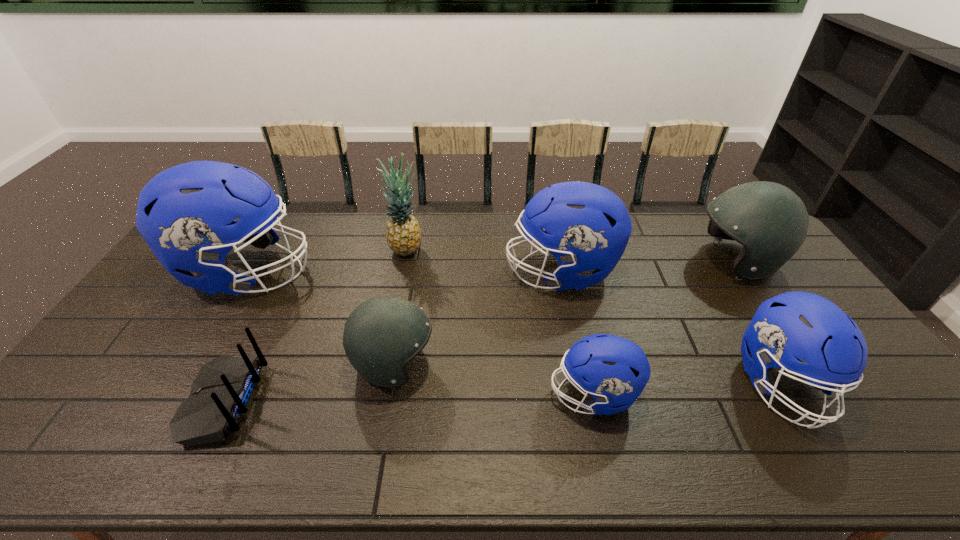
Identify which blue football helmet is the nearest to the smaller green football helmet. Please provide its 2D coordinates. Your answer should be formatted as a tuple, i.e. [(x, y)], where the tuple contains the x and y coordinates of a point satisfying the conditions above.

[(185, 214)]

This screenshot has height=540, width=960. Find the location of `vacant space that satisfies the following two spatial constraints: 1. on the front-facing side of the rightmost blue football helmet; 2. on the front-facing side of the smallest blue football helmet`. vacant space that satisfies the following two spatial constraints: 1. on the front-facing side of the rightmost blue football helmet; 2. on the front-facing side of the smallest blue football helmet is located at coordinates (788, 394).

The height and width of the screenshot is (540, 960). I want to click on free space that satisfies the following two spatial constraints: 1. at the face opening of the bigger green football helmet; 2. on the front-facing side of the rightmost blue football helmet, so click(x=817, y=383).